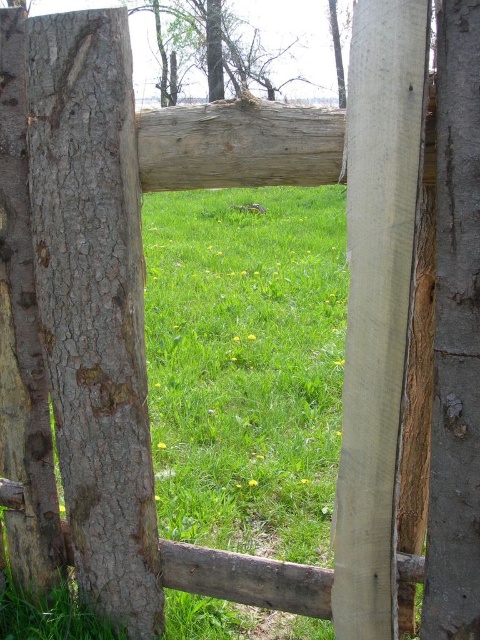
Describe the element at coordinates (95, 305) in the screenshot. I see `gray rough bark tree trunk at left` at that location.

Is gray rough bark tree trunk at left to the left of smooth bark tree at upper center from the viewer's perspective?

Indeed, gray rough bark tree trunk at left is positioned on the left side of smooth bark tree at upper center.

Measure the distance between point (90, 394) and camera.

1.92 meters

Identify the location of gray rough bark tree trunk at left. This screenshot has height=640, width=480. (95, 305).